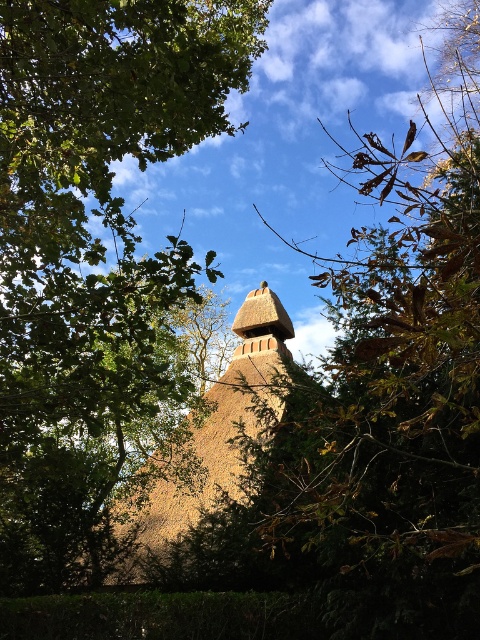
Can you confirm if brown textured chimney at center is shorter than brown thatched hut at center?

Incorrect, brown textured chimney at center's height does not fall short of brown thatched hut at center's.

Can you confirm if brown textured chimney at center is taller than brown thatched hut at center?

Yes.

The image size is (480, 640). What do you see at coordinates (388, 397) in the screenshot? I see `brown textured chimney at center` at bounding box center [388, 397].

Find the location of `brown textured chimney at center`. brown textured chimney at center is located at coordinates (388, 397).

Is green leafy tree at upper left thinner than brown thatched hut at center?

No.

Is point (112, 417) more distant than point (194, 502)?

That is False.

Which is in front, point (117, 252) or point (117, 577)?

Point (117, 252) is in front.

Where is `green leafy tree at upper left`? green leafy tree at upper left is located at coordinates (95, 253).

Is green leafy tree at upper left shorter than brown textured chimney at center?

Indeed, green leafy tree at upper left has a lesser height compared to brown textured chimney at center.

Is green leafy tree at upper left positioned before brown textured chimney at center?

No, green leafy tree at upper left is further to the viewer.

What do you see at coordinates (95, 253) in the screenshot? Image resolution: width=480 pixels, height=640 pixels. I see `green leafy tree at upper left` at bounding box center [95, 253].

Find the location of a particular element. The image size is (480, 640). green leafy tree at upper left is located at coordinates (95, 253).